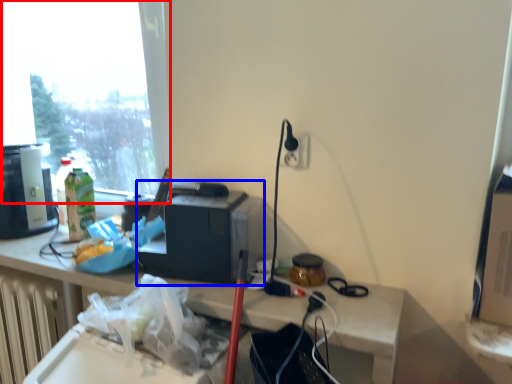
Question: Which object is closer to the camera taking this photo, window (highlighted by a red box) or appliance (highlighted by a blue box)?

Choices:
 (A) window
 (B) appliance

Answer: (B)